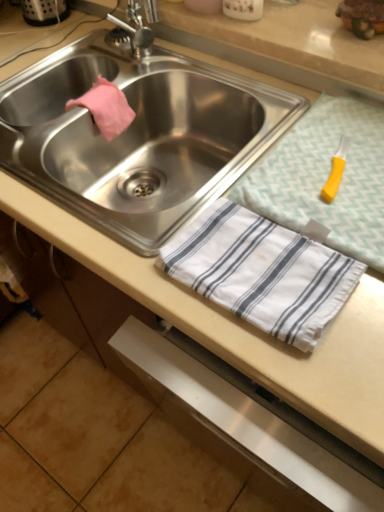
Measure the distance between stainless steel sink at center and camera.

stainless steel sink at center and camera are 25.45 inches apart from each other.

I want to click on stainless steel sink at center, so click(x=137, y=136).

This screenshot has width=384, height=512. Describe the element at coordinates (137, 136) in the screenshot. I see `stainless steel sink at center` at that location.

Based on the photo, what is the approximate width of yellow plastic knife at upper right?

It is 14.62 inches.

This screenshot has width=384, height=512. Describe the element at coordinates (326, 178) in the screenshot. I see `yellow plastic knife at upper right` at that location.

You are a GUI agent. You are given a task and a screenshot of the screen. Output one action in this format:
    pyautogui.click(x=<x>, y=<y>)
    Task: Click on the yellow plastic knife at upper right
    
    Given the screenshot: What is the action you would take?
    coord(326,178)

The height and width of the screenshot is (512, 384). Find the location of `stainless steel sink at center`. stainless steel sink at center is located at coordinates (137, 136).

Considering the relative positions of stainless steel sink at center and yellow plastic knife at upper right in the image provided, is stainless steel sink at center to the left of yellow plastic knife at upper right from the viewer's perspective?

Yes, stainless steel sink at center is to the left of yellow plastic knife at upper right.

Does stainless steel sink at center come behind yellow plastic knife at upper right?

Yes, it is behind yellow plastic knife at upper right.

Is point (109, 77) more distant than point (347, 214)?

Yes, point (109, 77) is behind point (347, 214).

From the image's perspective, would you say stainless steel sink at center is positioned over yellow plastic knife at upper right?

Yes, from the image's perspective, stainless steel sink at center is over yellow plastic knife at upper right.

From a real-world perspective, is stainless steel sink at center positioned over yellow plastic knife at upper right based on gravity?

Actually, stainless steel sink at center is physically below yellow plastic knife at upper right in the real world.

Considering the relative sizes of stainless steel sink at center and yellow plastic knife at upper right in the image provided, is stainless steel sink at center thinner than yellow plastic knife at upper right?

No, stainless steel sink at center is not thinner than yellow plastic knife at upper right.

Which of these two, stainless steel sink at center or yellow plastic knife at upper right, stands shorter?

yellow plastic knife at upper right is shorter.

Considering the sizes of stainless steel sink at center and yellow plastic knife at upper right in the image, is stainless steel sink at center bigger or smaller than yellow plastic knife at upper right?

Considering their sizes, stainless steel sink at center takes up more space than yellow plastic knife at upper right.

Can we say stainless steel sink at center lies outside yellow plastic knife at upper right?

stainless steel sink at center is positioned outside yellow plastic knife at upper right.

Based on the photo, would you say stainless steel sink at center is a long distance from yellow plastic knife at upper right?

stainless steel sink at center is actually quite close to yellow plastic knife at upper right.

Is stainless steel sink at center oriented away from yellow plastic knife at upper right?

stainless steel sink at center does not have its back to yellow plastic knife at upper right.

Where is `sink above the yellow plastic knife at upper right (from the image's perspective)`? Image resolution: width=384 pixels, height=512 pixels. sink above the yellow plastic knife at upper right (from the image's perspective) is located at coordinates click(x=137, y=136).

Considering the relative positions of yellow plastic knife at upper right and stainless steel sink at center in the image provided, is yellow plastic knife at upper right to the left or to the right of stainless steel sink at center?

From the image, it's evident that yellow plastic knife at upper right is to the right of stainless steel sink at center.

Is yellow plastic knife at upper right closer to the viewer compared to stainless steel sink at center?

Yes, yellow plastic knife at upper right is closer to the viewer.

Considering the positions of points (369, 257) and (255, 101), is point (369, 257) closer to camera compared to point (255, 101)?

Yes, point (369, 257) is in front of point (255, 101).

From the image's perspective, is yellow plastic knife at upper right on stainless steel sink at center?

No, from the image's perspective, yellow plastic knife at upper right is not over stainless steel sink at center.

From a real-world perspective, is yellow plastic knife at upper right under stainless steel sink at center?

Actually, yellow plastic knife at upper right is physically above stainless steel sink at center in the real world.

Is yellow plastic knife at upper right wider than stainless steel sink at center?

No, yellow plastic knife at upper right is not wider than stainless steel sink at center.

Considering the sizes of yellow plastic knife at upper right and stainless steel sink at center in the image, is yellow plastic knife at upper right taller or shorter than stainless steel sink at center?

In the image, yellow plastic knife at upper right appears to be shorter than stainless steel sink at center.

Looking at the image, does yellow plastic knife at upper right seem bigger or smaller compared to stainless steel sink at center?

In the image, yellow plastic knife at upper right appears to be smaller than stainless steel sink at center.

Looking at this image, is yellow plastic knife at upper right outside of stainless steel sink at center?

Yes, yellow plastic knife at upper right is located beyond the bounds of stainless steel sink at center.

Are yellow plastic knife at upper right and stainless steel sink at center beside each other?

No, yellow plastic knife at upper right is not beside stainless steel sink at center.

Consider the image. Is yellow plastic knife at upper right facing towards stainless steel sink at center?

No, yellow plastic knife at upper right is not oriented towards stainless steel sink at center.

How many degrees apart are the facing directions of yellow plastic knife at upper right and stainless steel sink at center?

yellow plastic knife at upper right and stainless steel sink at center are facing 1.37 degrees away from each other.

The height and width of the screenshot is (512, 384). Find the location of `tablecloth above the stainless steel sink at center (from a real-world perspective)`. tablecloth above the stainless steel sink at center (from a real-world perspective) is located at coordinates (326, 178).

Where is `sink directly beneath the yellow plastic knife at upper right (from a real-world perspective)`? The height and width of the screenshot is (512, 384). sink directly beneath the yellow plastic knife at upper right (from a real-world perspective) is located at coordinates (137, 136).

Where is `tablecloth below the stainless steel sink at center (from the image's perspective)`? The width and height of the screenshot is (384, 512). tablecloth below the stainless steel sink at center (from the image's perspective) is located at coordinates (326, 178).